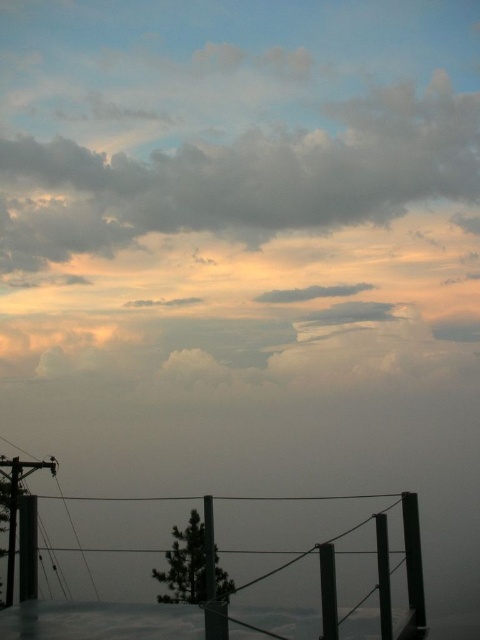
You are an artist trying to paint the scene. You need to decide which object, the cloudy sky at upper center or the metallic gray telegraph pole at lower left, you should sketch first based on their widths. Which one should you start with?

The cloudy sky at upper center has a lesser width compared to the metallic gray telegraph pole at lower left, so you should sketch the metallic gray telegraph pole at lower left first since it is wider and might form the base structure before adding the narrower sky element.

You are standing at the edge of a cliff overlooking the ocean, and you see a distant point marked as point (41, 188). If you want to throw a stone to reach that point, and your maximum throwing distance is 20 meters, will you be able to reach it?

The distance of point (41, 188) from the viewer is 19.14 meters, so yes, you can reach it because your maximum throwing distance is 20 meters, which is greater than 19.14 meters.

You are a bird flying over the scene and want to land on the nearest pole. Which pole should you choose between the metallic gray telegraph pole at lower left and the black matte pole at lower right?

The metallic gray telegraph pole at lower left is below the black matte pole at lower right, so the metallic gray telegraph pole at lower left is closer to the ground. Therefore, you should choose the metallic gray telegraph pole at lower left to land on since it is lower and easier to reach.